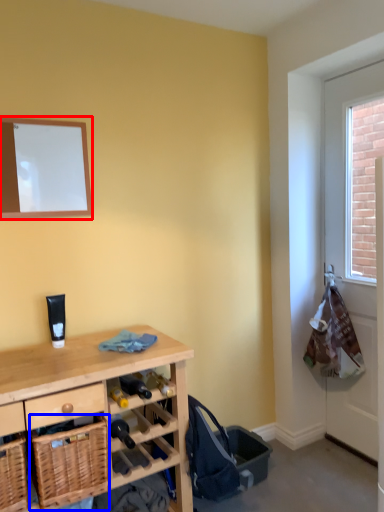
Question: Which point is further to the camera, mirror (highlighted by a red box) or basket (highlighted by a blue box)?

Choices:
 (A) mirror
 (B) basket

Answer: (A)